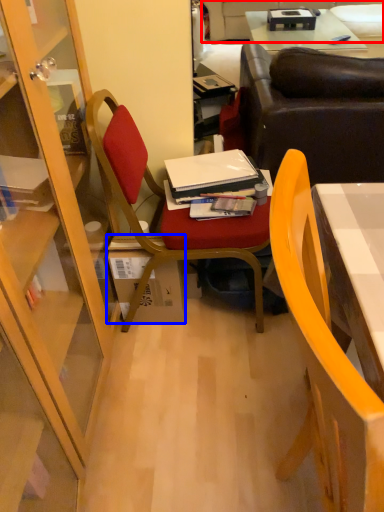
Question: Which point is further to the camera, couch (highlighted by a red box) or box (highlighted by a blue box)?

Choices:
 (A) couch
 (B) box

Answer: (A)